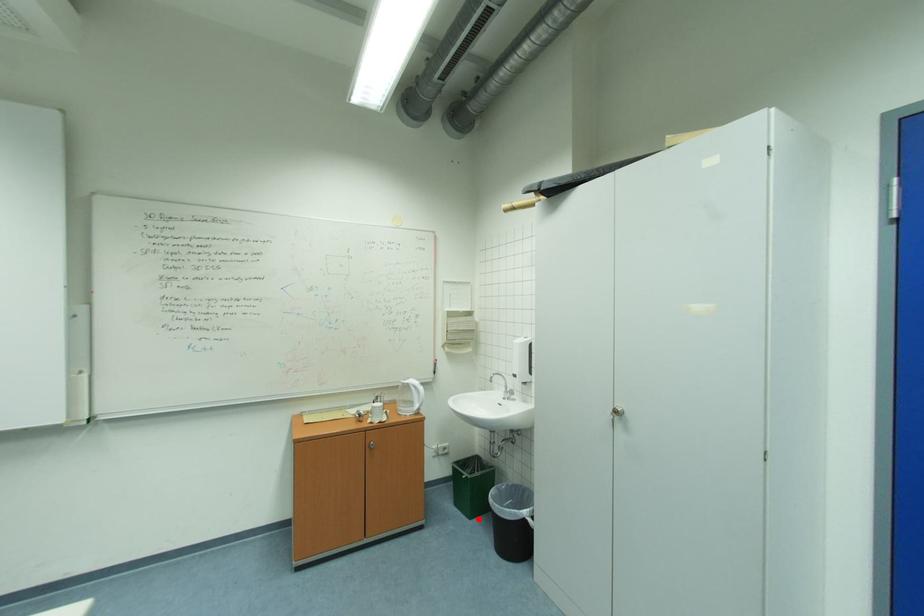
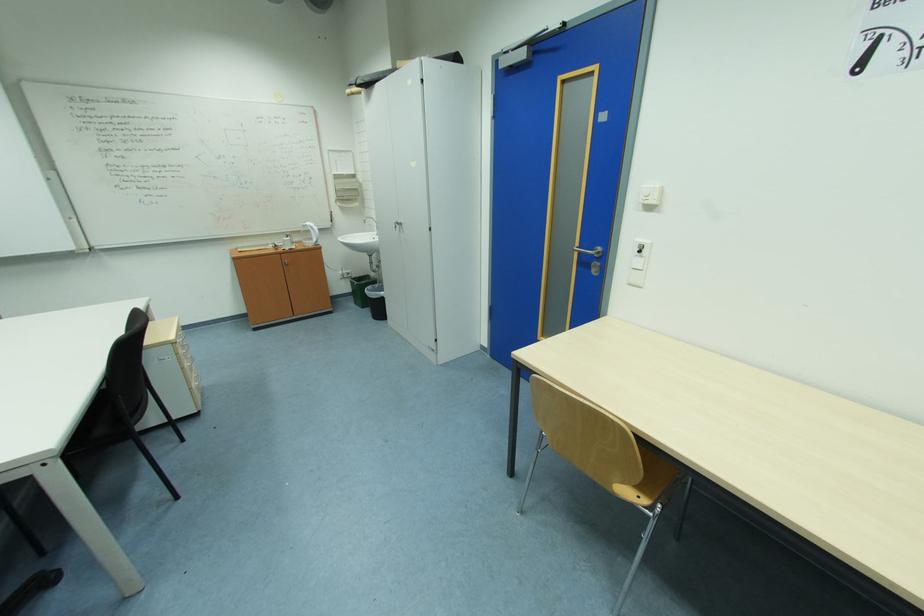
Question: I am providing you with two images of the same scene from different viewpoints. Image1 has a red point marked. In image2, the corresponding 3D location appears at what relative position? Reply with the corresponding letter.

Choices:
 (A) Closer
 (B) Farther

Answer: (A)